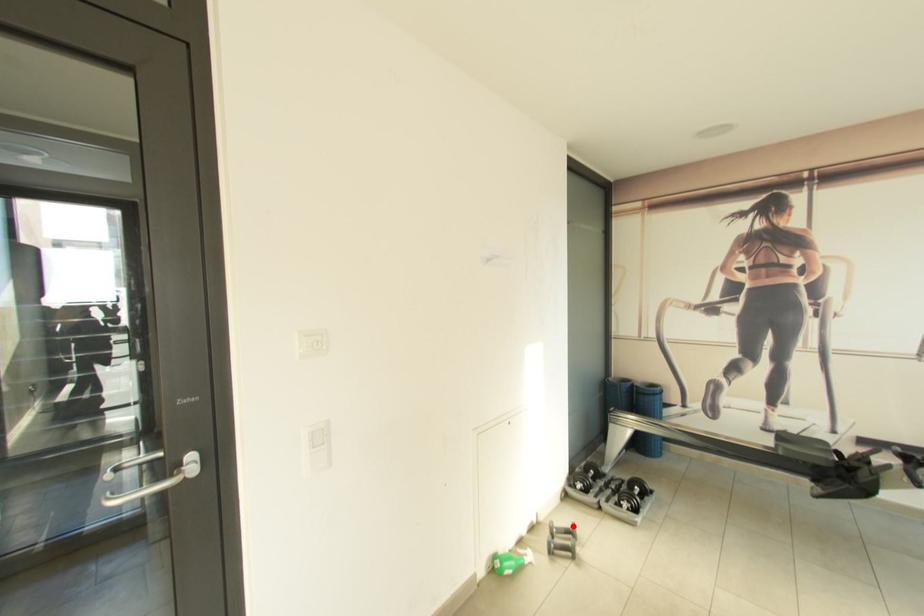
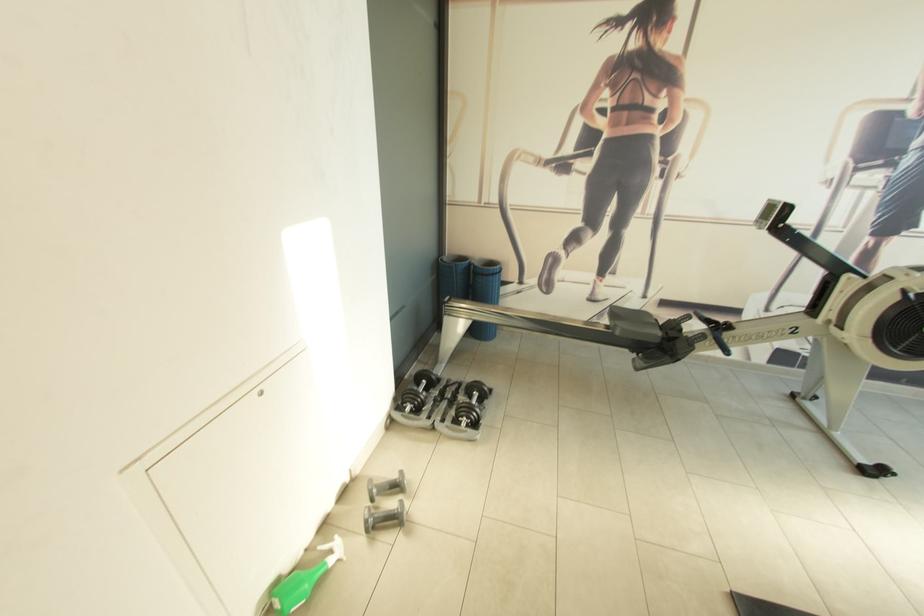
Where in the second image is the point corresponding to the highlighted location from the first image?

(398, 477)